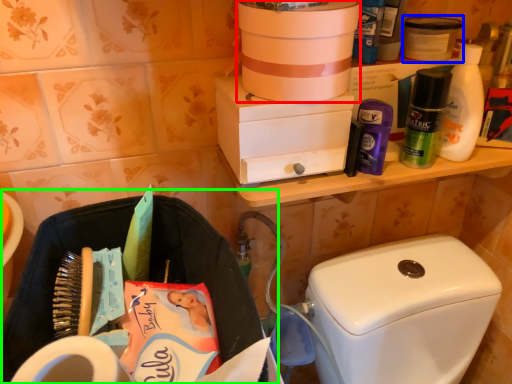
Question: Considering the real-world distances, which object is closest to box (highlighted by a red box)? product (highlighted by a blue box) or laundry basket (highlighted by a green box).

Choices:
 (A) product
 (B) laundry basket

Answer: (A)